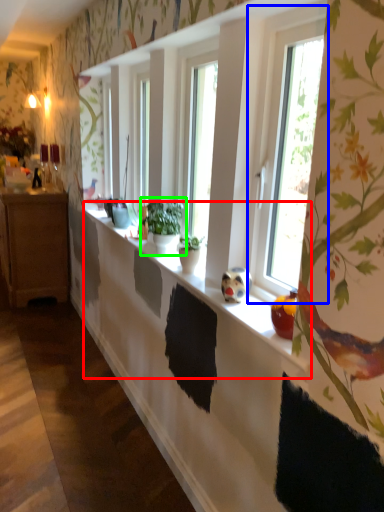
Question: Based on their relative distances, which object is farther from window sill (highlighted by a red box)? Choose from window (highlighted by a blue box) and houseplant (highlighted by a green box).

Choices:
 (A) window
 (B) houseplant

Answer: (A)